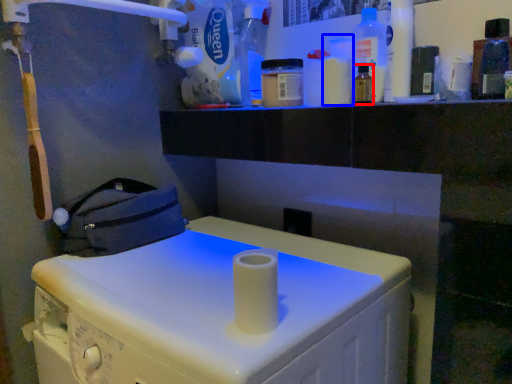
Question: Which point is further to the camera, bottle (highlighted by a red box) or bottle (highlighted by a blue box)?

Choices:
 (A) bottle
 (B) bottle

Answer: (B)